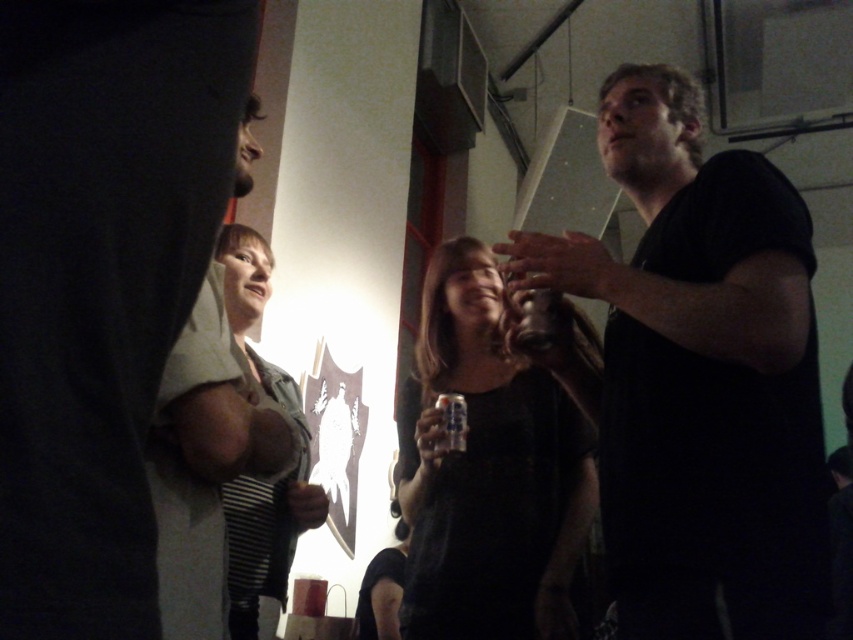
Does matte black shirt at upper right have a smaller size compared to metallic can at center?

No.

Who is taller, matte black shirt at upper right or metallic can at center?

With more height is matte black shirt at upper right.

Is point (85, 486) more distant than point (521, 337)?

No, (85, 486) is in front of (521, 337).

The image size is (853, 640). Find the location of `matte black shirt at upper right`. matte black shirt at upper right is located at coordinates (102, 282).

This screenshot has height=640, width=853. Describe the element at coordinates (488, 472) in the screenshot. I see `matte black can at center` at that location.

Does point (428, 324) come behind point (229, 230)?

No, (428, 324) is closer to viewer.

Image resolution: width=853 pixels, height=640 pixels. I want to click on matte black can at center, so click(x=488, y=472).

Between point (260, 458) and point (277, 577), which one is positioned behind?

The point (277, 577) is behind.

Looking at this image, how much distance is there between matte gray hoodie at left and striped fabric shirt at center?

50.65 centimeters

Where is `matte gray hoodie at left`? matte gray hoodie at left is located at coordinates (204, 461).

Image resolution: width=853 pixels, height=640 pixels. In order to click on matte gray hoodie at left in this screenshot , I will do `click(204, 461)`.